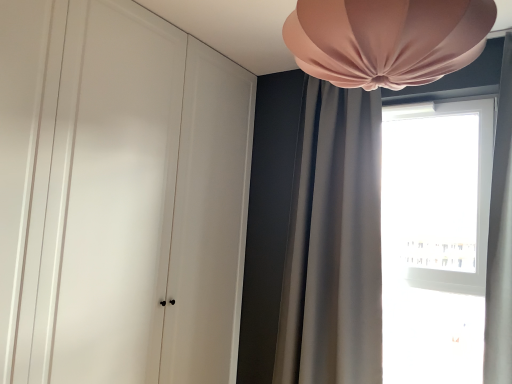
Question: Is satin gray curtain at upper right bigger than transparent glass window at right?

Choices:
 (A) no
 (B) yes

Answer: (B)

Question: Is satin gray curtain at upper right shorter than transparent glass window at right?

Choices:
 (A) no
 (B) yes

Answer: (A)

Question: Can you confirm if satin gray curtain at upper right is positioned to the left of transparent glass window at right?

Choices:
 (A) yes
 (B) no

Answer: (A)

Question: From a real-world perspective, is satin gray curtain at upper right located beneath transparent glass window at right?

Choices:
 (A) yes
 (B) no

Answer: (B)

Question: Is satin gray curtain at upper right positioned far away from transparent glass window at right?

Choices:
 (A) yes
 (B) no

Answer: (B)

Question: From their relative heights in the image, would you say transparent glass window at right is taller or shorter than pink fabric lampshade at upper center?

Choices:
 (A) short
 (B) tall

Answer: (B)

Question: In the image, is transparent glass window at right positioned in front of or behind pink fabric lampshade at upper center?

Choices:
 (A) behind
 (B) front

Answer: (A)

Question: Is transparent glass window at right wider or thinner than pink fabric lampshade at upper center?

Choices:
 (A) thin
 (B) wide

Answer: (A)

Question: Does point (397, 215) appear closer or farther from the camera than point (416, 46)?

Choices:
 (A) closer
 (B) farther

Answer: (B)

Question: Is matte white wardrobe at left taller or shorter than transparent glass window at right?

Choices:
 (A) short
 (B) tall

Answer: (B)

Question: Considering the positions of matte white wardrobe at left and transparent glass window at right in the image, is matte white wardrobe at left bigger or smaller than transparent glass window at right?

Choices:
 (A) small
 (B) big

Answer: (B)

Question: Is matte white wardrobe at left inside the boundaries of transparent glass window at right, or outside?

Choices:
 (A) inside
 (B) outside

Answer: (B)

Question: From a real-world perspective, relative to transparent glass window at right, is matte white wardrobe at left vertically above or below?

Choices:
 (A) below
 (B) above

Answer: (B)

Question: Is satin gray curtain at upper right bigger or smaller than pink fabric lampshade at upper center?

Choices:
 (A) small
 (B) big

Answer: (B)

Question: Which is correct: satin gray curtain at upper right is inside pink fabric lampshade at upper center, or outside of it?

Choices:
 (A) inside
 (B) outside

Answer: (B)